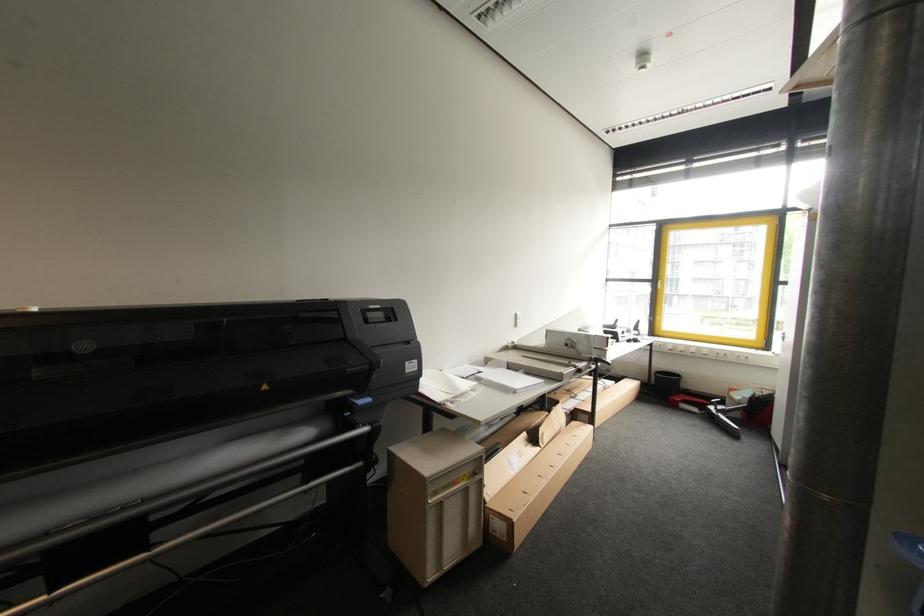
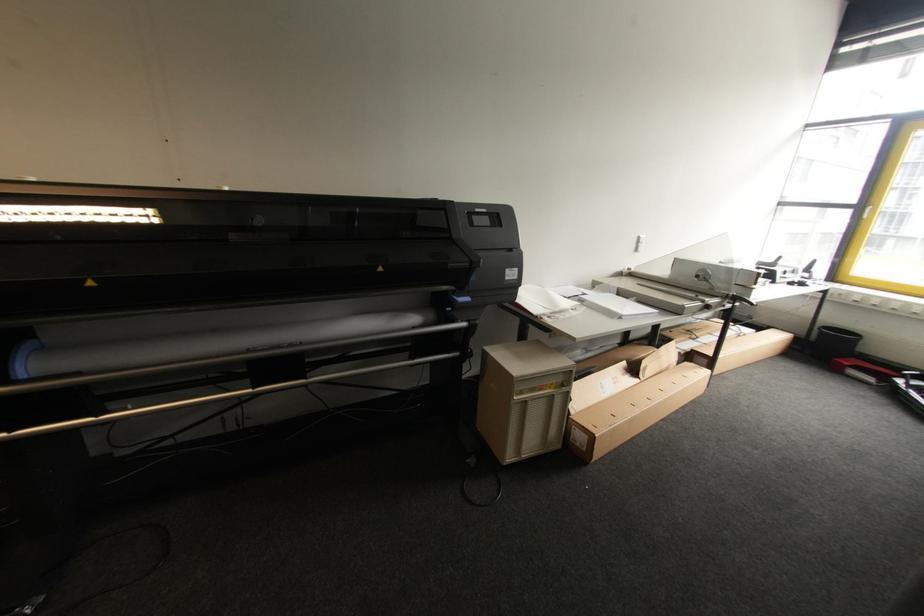
Question: What movement of the cameraman would produce the second image?

Choices:
 (A) Left
 (B) Right
 (C) Forward
 (D) Backward

Answer: (B)